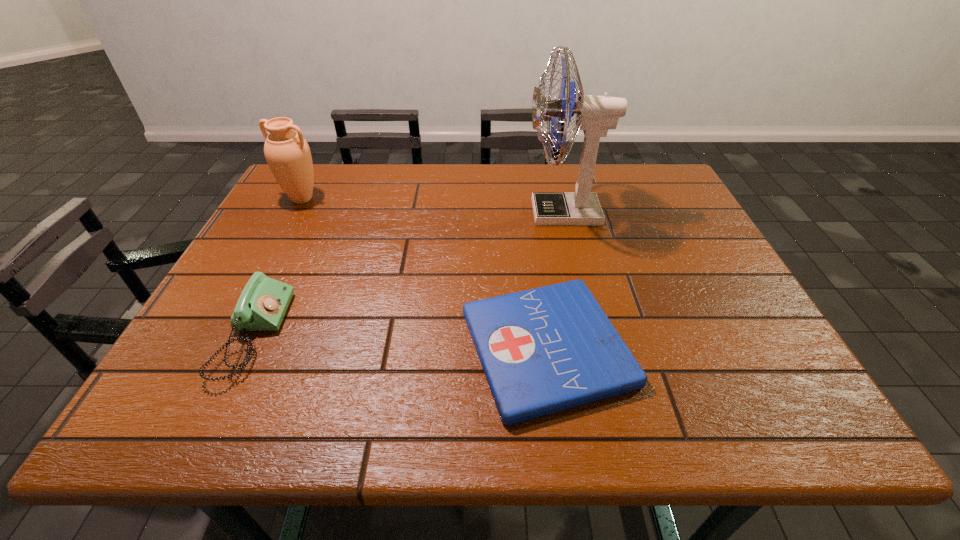
This screenshot has width=960, height=540. Find the location of `vacant area that lies between the second shortest object and the second tallest object`. vacant area that lies between the second shortest object and the second tallest object is located at coordinates coord(277,267).

I want to click on blank region between the shortest object and the fan, so click(x=556, y=280).

Where is `vacant area that lies between the telephone and the fan`? The height and width of the screenshot is (540, 960). vacant area that lies between the telephone and the fan is located at coordinates click(409, 273).

Locate an element on the screen. The image size is (960, 540). empty space that is in between the shortest object and the second tallest object is located at coordinates (424, 273).

At what (x,y) coordinates should I click in order to perform the action: click on unoccupied area between the third tallest object and the first-aid kit. Please return your answer as a coordinate pair (x, y). Looking at the image, I should click on (400, 341).

Point out which object is positioned as the third nearest to the fan. Please provide its 2D coordinates. Your answer should be formatted as a tuple, i.e. [(x, y)], where the tuple contains the x and y coordinates of a point satisfying the conditions above.

[(287, 153)]

Choose which object is the third nearest neighbor to the tallest object. Please provide its 2D coordinates. Your answer should be formatted as a tuple, i.e. [(x, y)], where the tuple contains the x and y coordinates of a point satisfying the conditions above.

[(287, 153)]

Locate an element on the screen. The height and width of the screenshot is (540, 960). vacant space that satisfies the following two spatial constraints: 1. on the back side of the first-aid kit; 2. on the dial of the third tallest object is located at coordinates (545, 334).

Locate an element on the screen. Image resolution: width=960 pixels, height=540 pixels. blank area in the image that satisfies the following two spatial constraints: 1. on the dial of the third tallest object; 2. on the back side of the shortest object is located at coordinates (248, 348).

Identify the location of free space that satisfies the following two spatial constraints: 1. on the dial of the telephone; 2. on the back side of the shortest object. The width and height of the screenshot is (960, 540). (248, 348).